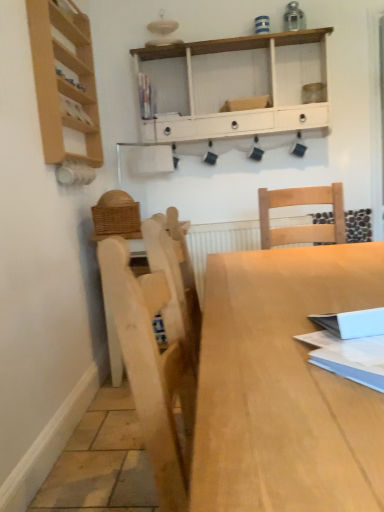
Question: Is the depth of light wood table at center less than that of matte plastic book at upper center, the 1th book when ordered from left to right?

Choices:
 (A) yes
 (B) no

Answer: (A)

Question: Is light wood table at center positioned with its back to matte plastic book at upper center, which is counted as the second book, starting from the right?

Choices:
 (A) no
 (B) yes

Answer: (A)

Question: From a real-world perspective, is light wood table at center on matte plastic book at upper center, marked as the 1th book in a back-to-front arrangement?

Choices:
 (A) yes
 (B) no

Answer: (B)

Question: From the image's perspective, is light wood table at center on matte plastic book at upper center, marked as the 1th book in a back-to-front arrangement?

Choices:
 (A) no
 (B) yes

Answer: (A)

Question: Considering the relative sizes of light wood table at center and matte plastic book at upper center, the 1th book when ordered from left to right, in the image provided, is light wood table at center wider than matte plastic book at upper center, the 1th book when ordered from left to right,?

Choices:
 (A) no
 (B) yes

Answer: (B)

Question: From their relative heights in the image, would you say light wood table at center is taller or shorter than matte plastic book at upper center, which is counted as the second book, starting from the right?

Choices:
 (A) short
 (B) tall

Answer: (B)

Question: In the image, is light wood table at center positioned in front of or behind matte plastic book at upper center, which is the 2th book from bottom to top?

Choices:
 (A) front
 (B) behind

Answer: (A)

Question: From the image's perspective, is light wood table at center located above or below matte plastic book at upper center, which is counted as the second book, starting from the right?

Choices:
 (A) below
 (B) above

Answer: (A)

Question: Looking at their shapes, would you say light wood table at center is wider or thinner than matte plastic book at upper center, arranged as the 1th book when viewed from the top?

Choices:
 (A) thin
 (B) wide

Answer: (B)

Question: Is white painted wood shelf at upper center, which is the first shelf from back to front, bigger or smaller than light wood table at center?

Choices:
 (A) big
 (B) small

Answer: (B)

Question: From the image's perspective, is white painted wood shelf at upper center, which is the first shelf in right-to-left order, above or below light wood table at center?

Choices:
 (A) below
 (B) above

Answer: (B)

Question: In terms of height, does white painted wood shelf at upper center, marked as the second shelf in a front-to-back arrangement, look taller or shorter compared to light wood table at center?

Choices:
 (A) short
 (B) tall

Answer: (A)

Question: Is white painted wood shelf at upper center, which is the first shelf in right-to-left order, inside the boundaries of light wood table at center, or outside?

Choices:
 (A) inside
 (B) outside

Answer: (B)

Question: Considering the positions of light wood shelf at left, which appears as the first shelf when viewed from the left, and matte plastic book at upper center, which is the 2th book from bottom to top, in the image, is light wood shelf at left, which appears as the first shelf when viewed from the left, bigger or smaller than matte plastic book at upper center, which is the 2th book from bottom to top,?

Choices:
 (A) small
 (B) big

Answer: (B)

Question: Is light wood shelf at left, the second shelf positioned from the right, inside or outside of matte plastic book at upper center, marked as the 1th book in a back-to-front arrangement?

Choices:
 (A) outside
 (B) inside

Answer: (A)